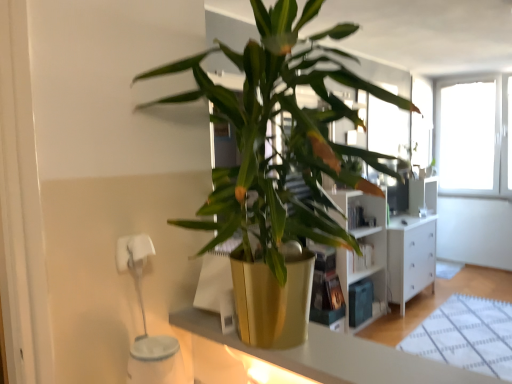
Question: From the image's perspective, is metallic gold pot at center below gold metallic pot at center?

Choices:
 (A) no
 (B) yes

Answer: (B)

Question: From the image's perspective, is metallic gold pot at center above gold metallic pot at center?

Choices:
 (A) no
 (B) yes

Answer: (A)

Question: Does metallic gold pot at center have a greater width compared to gold metallic pot at center?

Choices:
 (A) no
 (B) yes

Answer: (A)

Question: From a real-world perspective, is metallic gold pot at center below gold metallic pot at center?

Choices:
 (A) yes
 (B) no

Answer: (A)

Question: Considering the relative sizes of metallic gold pot at center and gold metallic pot at center in the image provided, is metallic gold pot at center smaller than gold metallic pot at center?

Choices:
 (A) no
 (B) yes

Answer: (B)

Question: Considering the relative positions of metallic gold pot at center and gold metallic pot at center in the image provided, is metallic gold pot at center to the left of gold metallic pot at center from the viewer's perspective?

Choices:
 (A) no
 (B) yes

Answer: (B)

Question: Can you confirm if gold metallic pot at center is shorter than metallic gold pot at center?

Choices:
 (A) no
 (B) yes

Answer: (A)

Question: Is gold metallic pot at center smaller than metallic gold pot at center?

Choices:
 (A) yes
 (B) no

Answer: (B)

Question: From the image's perspective, would you say gold metallic pot at center is shown under metallic gold pot at center?

Choices:
 (A) no
 (B) yes

Answer: (A)

Question: Is the depth of gold metallic pot at center greater than that of metallic gold pot at center?

Choices:
 (A) no
 (B) yes

Answer: (A)

Question: Does gold metallic pot at center have a greater height compared to metallic gold pot at center?

Choices:
 (A) yes
 (B) no

Answer: (A)

Question: Considering the relative positions of gold metallic pot at center and metallic gold pot at center in the image provided, is gold metallic pot at center to the left of metallic gold pot at center from the viewer's perspective?

Choices:
 (A) yes
 (B) no

Answer: (B)

Question: In terms of width, does gold metallic pot at center look wider or thinner when compared to metallic gold pot at center?

Choices:
 (A) wide
 (B) thin

Answer: (A)